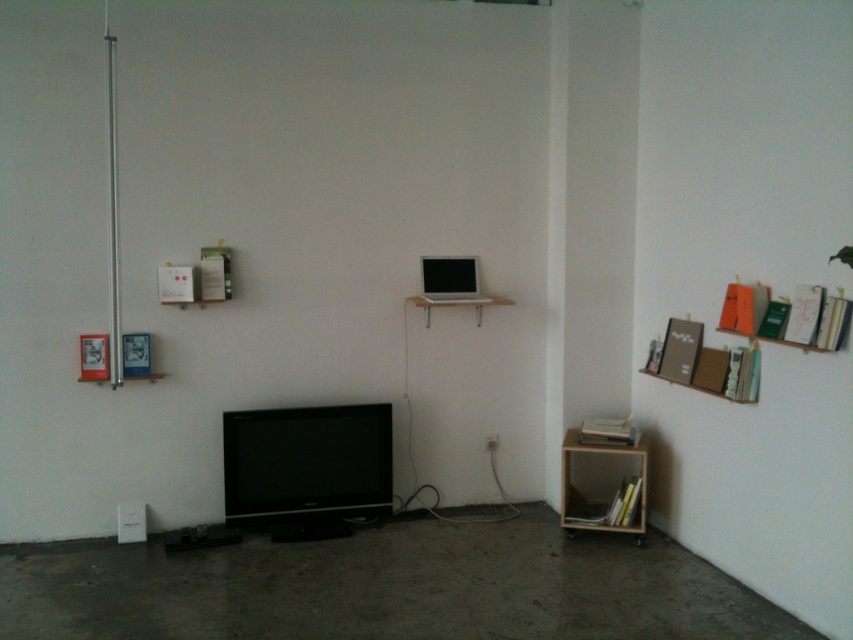
Question: Which point is farther from the camera taking this photo?

Choices:
 (A) (560, 518)
 (B) (341, 429)

Answer: (A)

Question: Can you confirm if black glossy flat screen tv at center is smaller than wooden bookshelf at lower right?

Choices:
 (A) yes
 (B) no

Answer: (B)

Question: Does black glossy flat screen tv at center have a larger size compared to wooden bookshelf at lower right?

Choices:
 (A) no
 (B) yes

Answer: (B)

Question: Which object appears closest to the camera in this image?

Choices:
 (A) black glossy flat screen tv at center
 (B) wooden bookshelf at lower right

Answer: (B)

Question: Does black glossy flat screen tv at center have a larger size compared to wooden bookshelf at lower right?

Choices:
 (A) yes
 (B) no

Answer: (A)